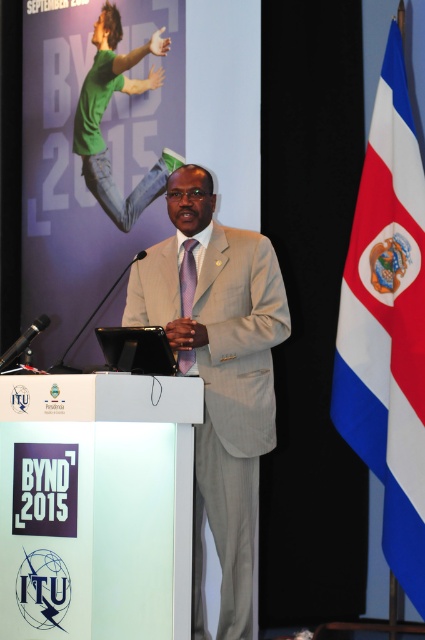
Is beige textured suit at center positioned in front of purple satin tie at center?

That is True.

Is beige textured suit at center shorter than purple satin tie at center?

No, beige textured suit at center is not shorter than purple satin tie at center.

Does point (212, 385) lie in front of point (181, 259)?

Yes.

Identify the location of beige textured suit at center. Image resolution: width=425 pixels, height=640 pixels. (220, 376).

Locate an element on the screen. This screenshot has width=425, height=640. white fabric flag at right is located at coordinates (388, 324).

Consider the image. Is white fabric flag at right positioned before green matte t-shirt at upper left?

Yes.

Which is in front, point (396, 177) or point (132, 220)?

Positioned in front is point (396, 177).

Locate an element on the screen. white fabric flag at right is located at coordinates (388, 324).

Can you confirm if white fabric flag at right is positioned to the left of purple satin tie at center?

In fact, white fabric flag at right is to the right of purple satin tie at center.

Does white fabric flag at right have a lesser width compared to purple satin tie at center?

Incorrect, white fabric flag at right's width is not less than purple satin tie at center's.

What do you see at coordinates (388, 324) in the screenshot? I see `white fabric flag at right` at bounding box center [388, 324].

I want to click on white fabric flag at right, so click(x=388, y=324).